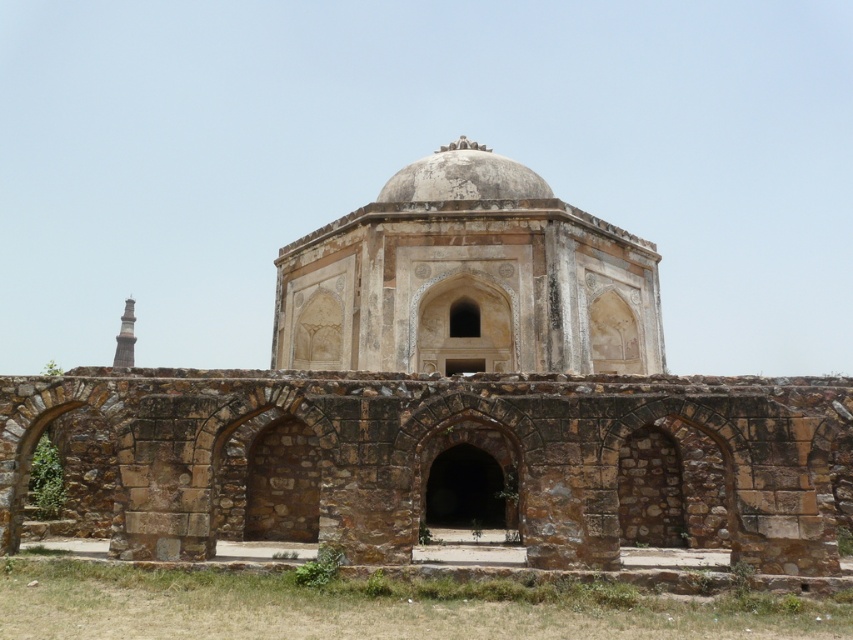
Question: Which of the following is the farthest from the observer?

Choices:
 (A) stone dome at center
 (B) white stone dome at center

Answer: (B)

Question: Does stone dome at center come behind white stone dome at center?

Choices:
 (A) no
 (B) yes

Answer: (A)

Question: Among these objects, which one is farthest from the camera?

Choices:
 (A) white stone dome at center
 (B) stone dome at center

Answer: (A)

Question: Is stone dome at center further to camera compared to white stone dome at center?

Choices:
 (A) yes
 (B) no

Answer: (B)

Question: From the image, what is the correct spatial relationship of stone dome at center in relation to white stone dome at center?

Choices:
 (A) below
 (B) above

Answer: (A)

Question: Which object is closer to the camera taking this photo?

Choices:
 (A) stone dome at center
 (B) white stone dome at center

Answer: (A)